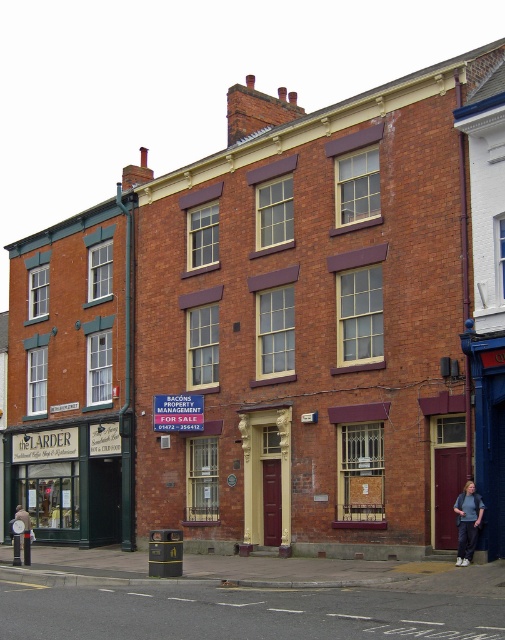
Question: Is green wood signboard at lower left to the right of denim pants at lower right from the viewer's perspective?

Choices:
 (A) no
 (B) yes

Answer: (A)

Question: In this image, where is green wood signboard at lower left located relative to denim pants at lower right?

Choices:
 (A) above
 (B) below

Answer: (B)

Question: Which point is farther from the camera taking this photo?

Choices:
 (A) (121, 456)
 (B) (457, 561)

Answer: (A)

Question: Which point is farther from the camera taking this photo?

Choices:
 (A) (477, 512)
 (B) (84, 460)

Answer: (B)

Question: Can you confirm if green wood signboard at lower left is smaller than denim pants at lower right?

Choices:
 (A) yes
 (B) no

Answer: (A)